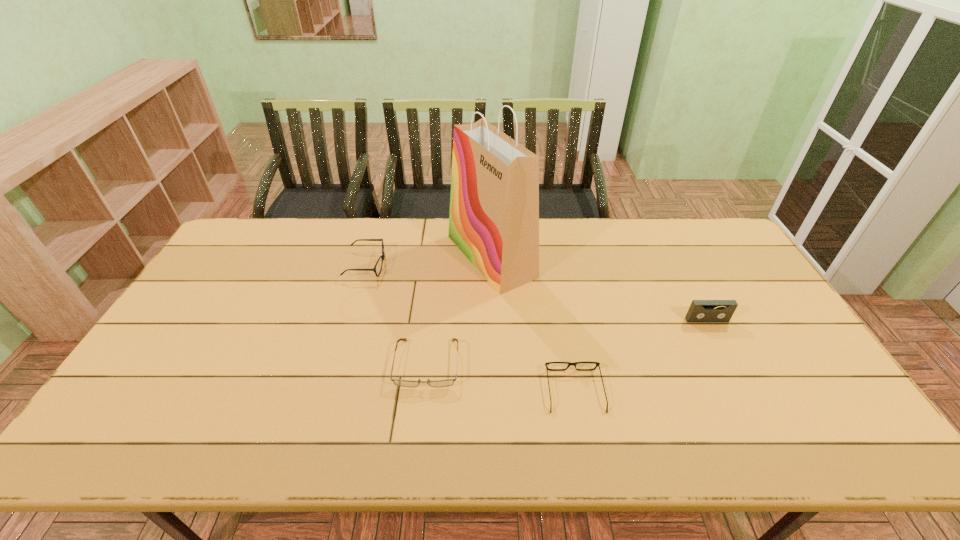
Identify the location of object that stands as the fourth closest to the shopping bag. (700, 311).

The height and width of the screenshot is (540, 960). Find the location of `spectacles that is the second closest to the leftmost object`. spectacles that is the second closest to the leftmost object is located at coordinates (569, 363).

At what (x,y) coordinates should I click in order to perform the action: click on spectacles that stands as the closest to the shopping bag. Please return your answer as a coordinate pair (x, y). Image resolution: width=960 pixels, height=540 pixels. Looking at the image, I should click on (404, 383).

Identify the location of vacant space that satisfies the following two spatial constraints: 1. on the front-facing side of the rightmost spectacles; 2. on the front-facing side of the leftmost object. pos(551,265).

Where is `vacant space that satisfies the following two spatial constraints: 1. on the front-facing side of the tallest spectacles; 2. on the front-facing side of the rightmost spectacles`? vacant space that satisfies the following two spatial constraints: 1. on the front-facing side of the tallest spectacles; 2. on the front-facing side of the rightmost spectacles is located at coordinates (329, 391).

Identify the location of vacant space that satisfies the following two spatial constraints: 1. on the front-facing side of the rightmost spectacles; 2. on the front-facing side of the leftmost object. (551, 265).

This screenshot has width=960, height=540. In order to click on vacant space that satisfies the following two spatial constraints: 1. on the front-facing side of the leftmost spectacles; 2. on the front-facing side of the rightmost spectacles in this screenshot , I will do (329, 391).